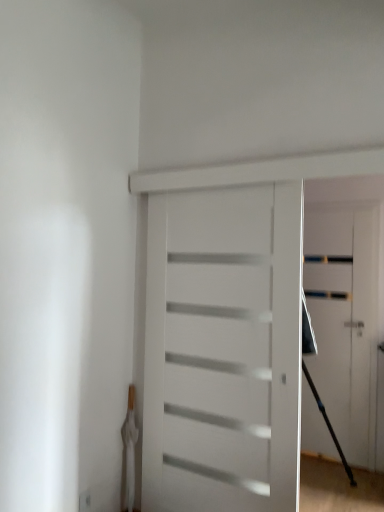
What do you see at coordinates (345, 322) in the screenshot? I see `white matte door at center` at bounding box center [345, 322].

From the picture: Measure the distance between white matte door at center and camera.

10.82 feet.

This screenshot has width=384, height=512. In order to click on white matte door at center in this screenshot , I will do `click(345, 322)`.

Find the location of a particular element. This screenshot has height=512, width=384. white matte door at center is located at coordinates (345, 322).